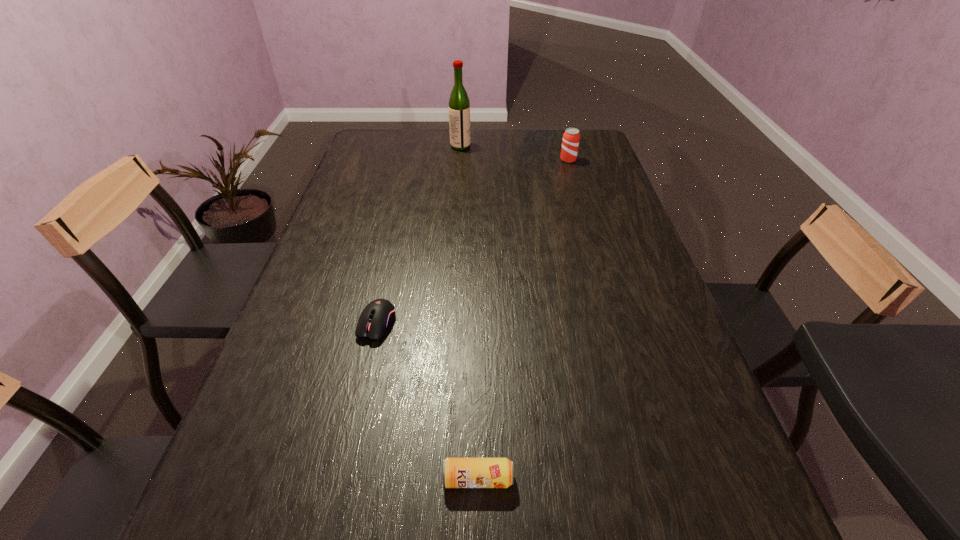
Identify the location of free region at the far right corner. (599, 151).

You are a GUI agent. You are given a task and a screenshot of the screen. Output one action in this format:
    pyautogui.click(x=<x>, y=<y>)
    Task: Click on the free space between the leftmost object and the farthest object
    
    Given the screenshot: What is the action you would take?
    pyautogui.click(x=419, y=235)

Locate an element on the screen. Image resolution: width=960 pixels, height=540 pixels. unoccupied position between the left beer can and the farther beer can is located at coordinates (523, 319).

Identify the location of empty location between the right beer can and the liquor. (515, 153).

At what (x,y) coordinates should I click in order to perform the action: click on free space between the left beer can and the right beer can. Please return your answer as a coordinate pair (x, y). This screenshot has width=960, height=540. Looking at the image, I should click on (523, 319).

Locate an element on the screen. Image resolution: width=960 pixels, height=540 pixels. free space between the farthest object and the third shortest object is located at coordinates (515, 153).

Find the location of `empty space that is in between the nearest object and the liquor`. empty space that is in between the nearest object and the liquor is located at coordinates (469, 313).

Identify the location of free space between the farthest object and the second farthest object. (515, 153).

Where is `free point between the farthest object and the leftmost object`? The width and height of the screenshot is (960, 540). free point between the farthest object and the leftmost object is located at coordinates (419, 235).

Find the location of a particular element. The image size is (960, 540). vacant point located between the tallest object and the leftmost object is located at coordinates (419, 235).